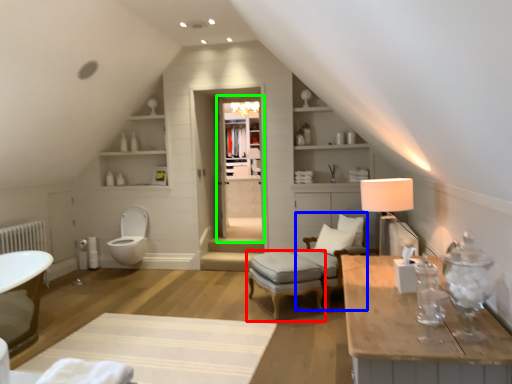
Question: Considering the real-world distances, which object is farthest from stool (highlighted by a red box)? swivel chair (highlighted by a blue box) or glass door (highlighted by a green box)?

Choices:
 (A) swivel chair
 (B) glass door

Answer: (B)